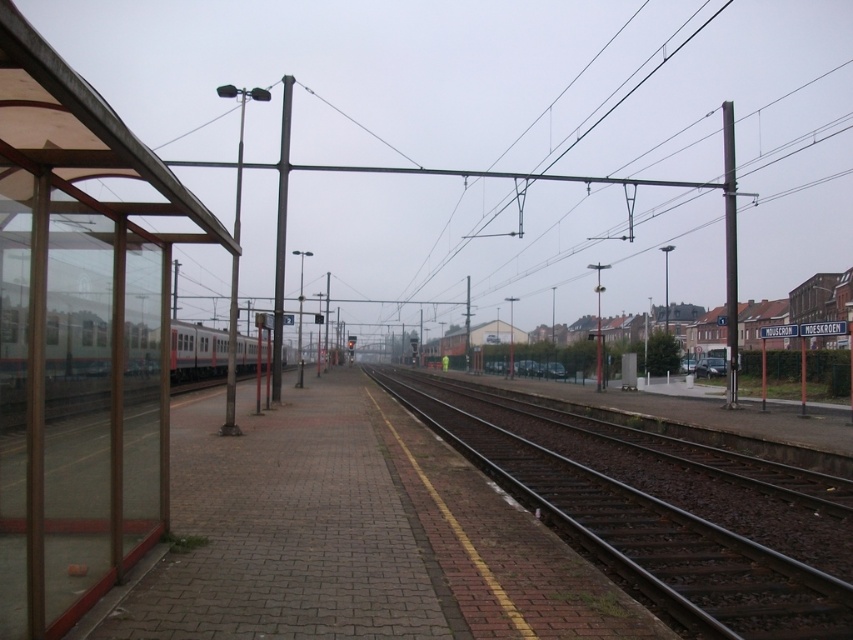
Is black metal pole at center shorter than metallic pole at left?

Yes, black metal pole at center is shorter than metallic pole at left.

Does black metal pole at center appear on the left side of metallic pole at left?

In fact, black metal pole at center is to the right of metallic pole at left.

Who is more distant from viewer, (283,257) or (231,92)?

Point (283,257)

In order to click on black metal pole at center in this screenshot , I will do `click(280, 237)`.

Can you confirm if metal at center is taller than green matte passenger train at left?

No.

Between metal at center and green matte passenger train at left, which one has more height?

Standing taller between the two is green matte passenger train at left.

Which is behind, point (607, 513) or point (102, 360)?

Point (607, 513)

Identify the location of metal at center. (647, 538).

Who is positioned more to the left, metal at center or black metal pole at center?

Positioned to the left is black metal pole at center.

The height and width of the screenshot is (640, 853). Describe the element at coordinates (647, 538) in the screenshot. I see `metal at center` at that location.

Between point (811, 579) and point (276, 360), which one is positioned in front?

Point (811, 579)

The height and width of the screenshot is (640, 853). What are the coordinates of `metal at center` in the screenshot? It's located at (647, 538).